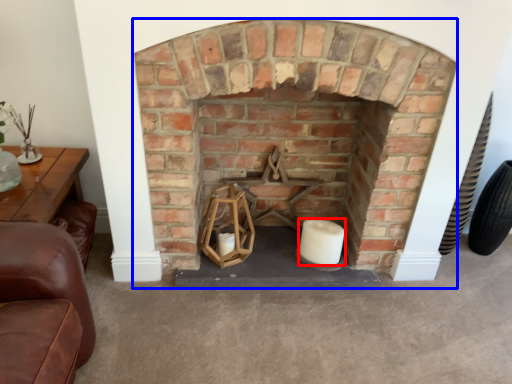
Question: Which point is closer to the camera, candle (highlighted by a red box) or fireplace (highlighted by a blue box)?

Choices:
 (A) candle
 (B) fireplace

Answer: (B)